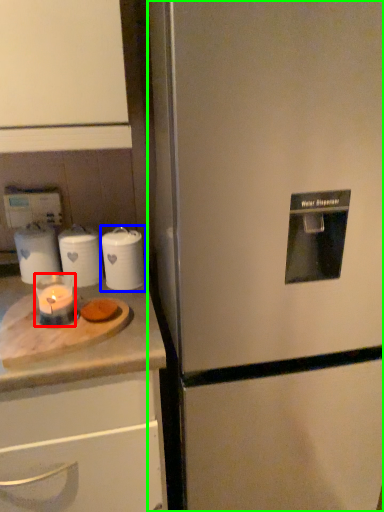
Question: Which object is the farthest from candle holder (highlighted by a red box)? Choose among these: kitchen appliance (highlighted by a blue box) or refrigerator (highlighted by a green box).

Choices:
 (A) kitchen appliance
 (B) refrigerator

Answer: (B)